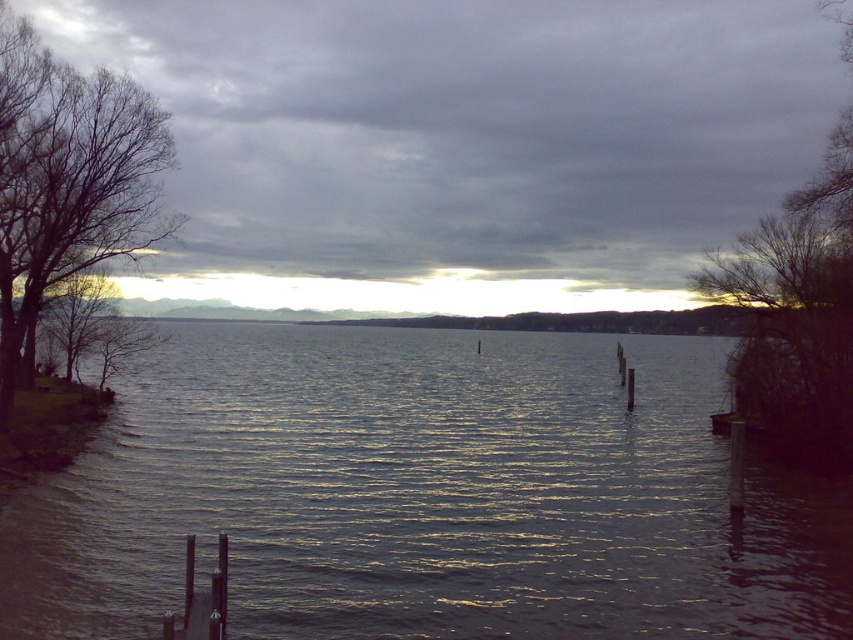
Is bare branches at right bigger than smooth wood dock at lower left?

Correct, bare branches at right is larger in size than smooth wood dock at lower left.

Does bare branches at right appear under smooth wood dock at lower left?

Actually, bare branches at right is above smooth wood dock at lower left.

Is point (849, 369) farther from camera compared to point (206, 598)?

Yes, it is.

Identify the location of bare branches at right. Image resolution: width=853 pixels, height=640 pixels. (796, 314).

Does shiny blue water at center appear under gray cloudy sky at upper center?

Yes, shiny blue water at center is below gray cloudy sky at upper center.

Who is positioned more to the right, shiny blue water at center or gray cloudy sky at upper center?

shiny blue water at center

Who is more forward, (132, 548) or (297, 172)?

Point (132, 548)

Locate an element on the screen. shiny blue water at center is located at coordinates (426, 497).

Who is higher up, bare branches at left or smooth wood dock at lower left?

Positioned higher is bare branches at left.

This screenshot has height=640, width=853. What do you see at coordinates (68, 179) in the screenshot?
I see `bare branches at left` at bounding box center [68, 179].

Image resolution: width=853 pixels, height=640 pixels. What do you see at coordinates (68, 179) in the screenshot?
I see `bare branches at left` at bounding box center [68, 179].

Find the location of a particular element. bare branches at left is located at coordinates (68, 179).